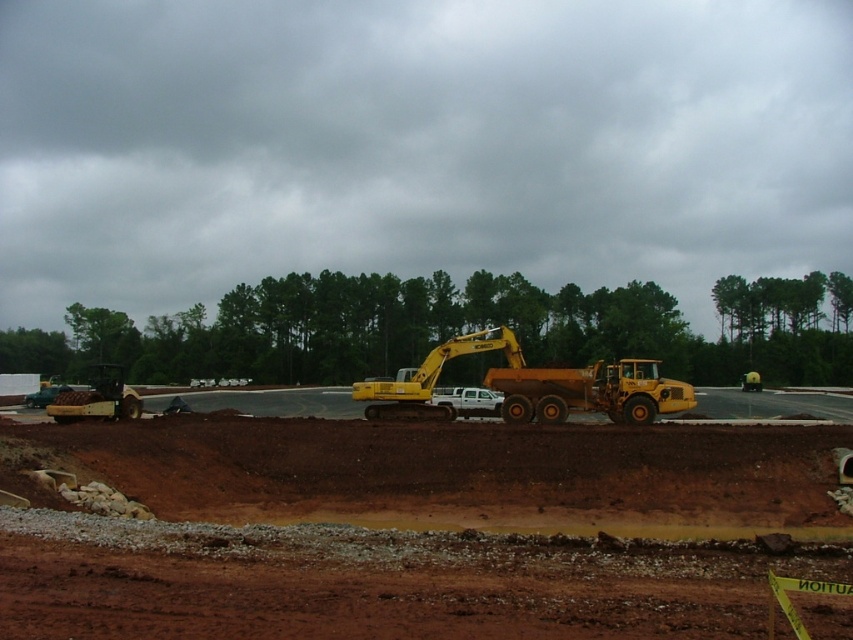
You are a construction worker who needs to place a 2.5 meter tall safety barrier between the brown soil at center and the yellow metallic excavator at center. Can you fit it vertically between them?

The brown soil at center is shorter than the yellow metallic excavator at center. Since the safety barrier is 2.5 meters tall, it can be placed vertically between them as long as the height difference allows. However, the exact feasibility depends on the actual height of the soil and the excavator, which aren

You are a construction worker needing to transport materials from the brown soil at center to the yellow metallic excavator at center. Given that your wheelbarrow can carry a maximum of 100 kg and each trip covers 15 meters, how many trips would you need to move 300 kg of soil?

The distance between the brown soil at center and the yellow metallic excavator at center is 12.60 meters. Each trip covers 15 meters, so one trip is sufficient to cover the distance. To move 300 kg with a 100 kg capacity, you would need 3 trips.

From the picture: You are a construction worker who needs to place a 3m wide safety barrier between the brown soil at center and the yellow metallic excavator at center. Based on their widths, can you determine if there is enough space to fit the barrier between them?

The brown soil at center is wider than the yellow metallic excavator at center, so there is sufficient space to place the 3m wide safety barrier between them.